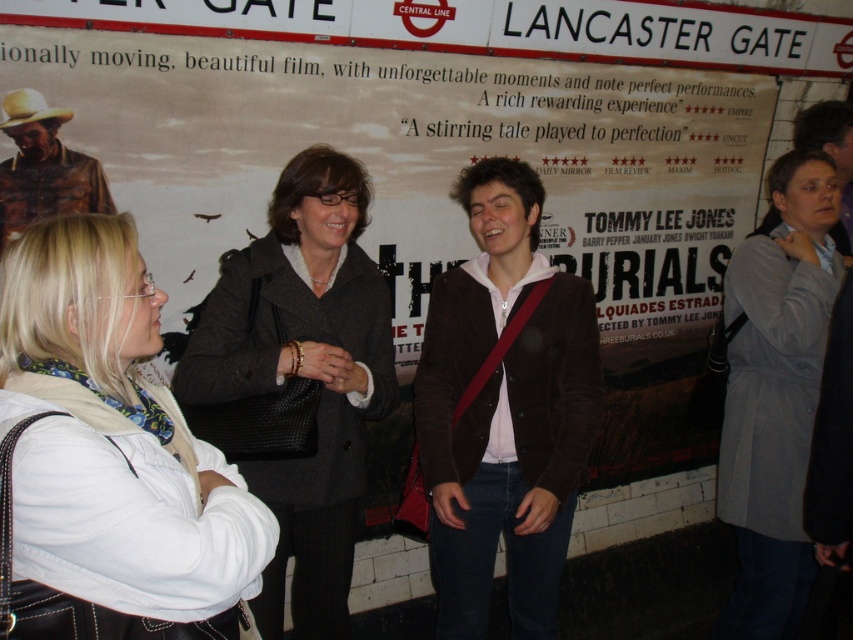
You are a photographer at the station and need to capture a photo of the group without any clothing items overlapping. Given the sizes of the white leather jacket at lower left and the dark gray wool coat at center, which clothing item should you position closer to the camera to ensure the other remains in frame?

The white leather jacket at lower left is smaller than the dark gray wool coat at center. To prevent overlap and keep both in frame, position the smaller white leather jacket at lower left closer to the camera so the larger coat can be seen fully behind it.

You are a person standing at the point marked as point (x=831, y=156). You want to move to the movie poster displayed at Lancaster Gate station. Is there a gray wool coat at right blocking your path?

Yes, the gray wool coat at right is blocking your path as it is located at point (x=831, y=156) which is your current position, and the movie poster is at Lancaster Gate station, so the coat is in your way.